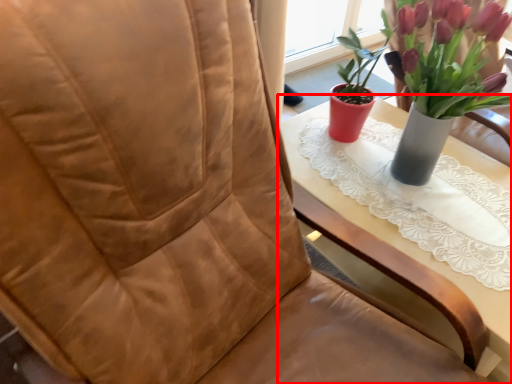
Question: In this image, where is table (annotated by the red box) located relative to houseplant?

Choices:
 (A) left
 (B) right

Answer: (A)